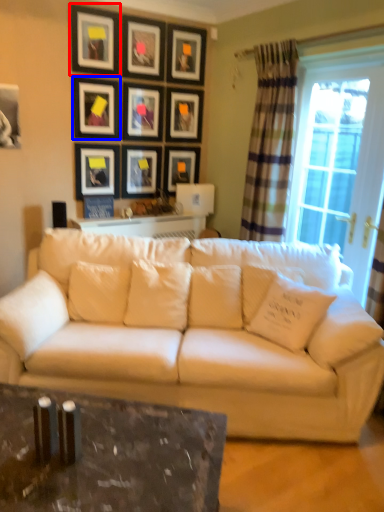
Question: Which point is closer to the camera, picture frame (highlighted by a red box) or picture frame (highlighted by a blue box)?

Choices:
 (A) picture frame
 (B) picture frame

Answer: (A)